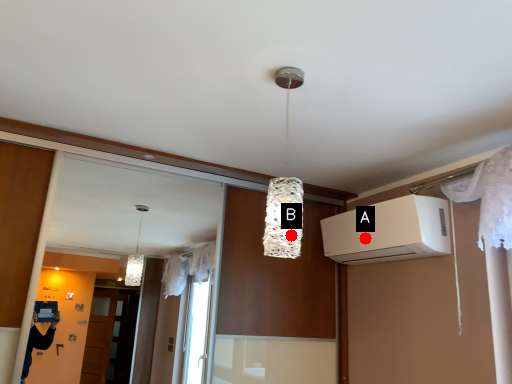
Question: Two points are circled on the image, labeled by A and B beside each circle. Which of the following is the farthest from the observer?

Choices:
 (A) A is further
 (B) B is further

Answer: (A)